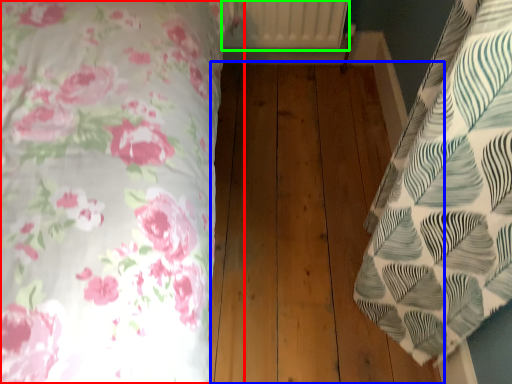
Question: Which object is the closest to the bed (highlighted by a red box)? Choose among these: hardwood (highlighted by a blue box) or radiator (highlighted by a green box).

Choices:
 (A) hardwood
 (B) radiator

Answer: (A)